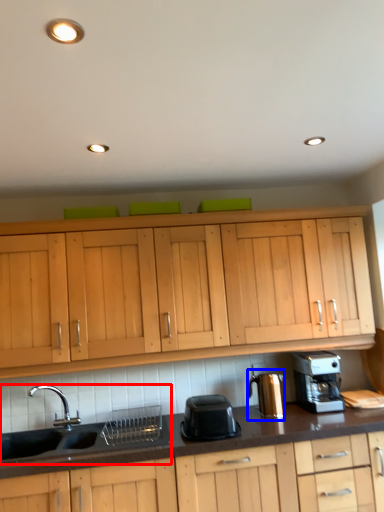
Question: Which of the following is the farthest to the observer, sink (highlighted by a red box) or coffee machine (highlighted by a blue box)?

Choices:
 (A) sink
 (B) coffee machine

Answer: (B)